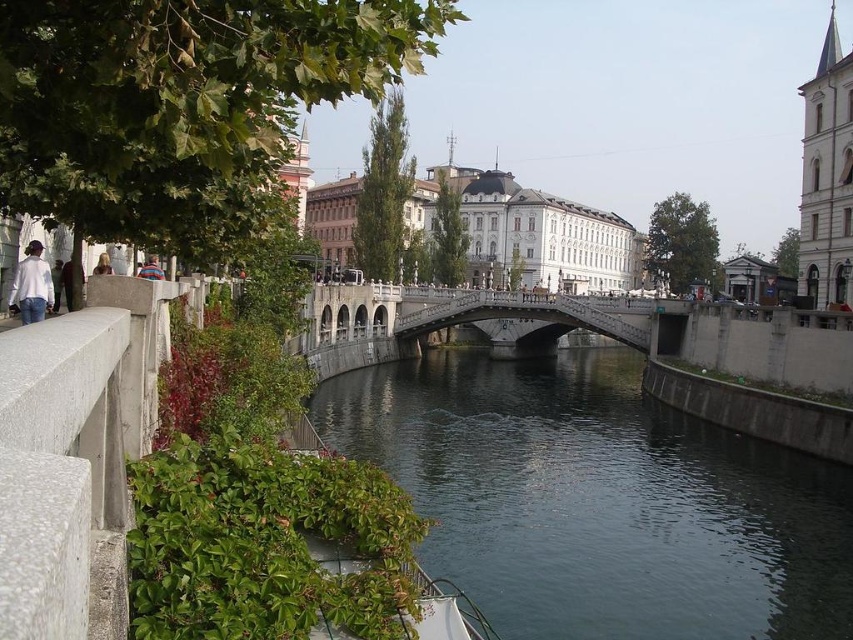
Question: In this image, where is green concrete river at center located relative to light brown leather jacket at upper left?

Choices:
 (A) right
 (B) left

Answer: (A)

Question: Is white stone bridge at center above white matte shirt at left?

Choices:
 (A) yes
 (B) no

Answer: (B)

Question: Among these objects, which one is farthest from the camera?

Choices:
 (A) light brown leather jacket at upper left
 (B) white matte shirt at left

Answer: (A)

Question: Is white matte shirt at left wider than blue striped shirt at center?

Choices:
 (A) yes
 (B) no

Answer: (A)

Question: Estimate the real-world distances between objects in this image. Which object is farther from the white stone bridge at center?

Choices:
 (A) blue striped shirt at center
 (B) light brown leather jacket at upper left
 (C) white matte shirt at left

Answer: (B)

Question: Which object is positioned farthest from the green concrete river at center?

Choices:
 (A) white stone bridge at center
 (B) light brown leather jacket at upper left
 (C) white matte shirt at left

Answer: (B)